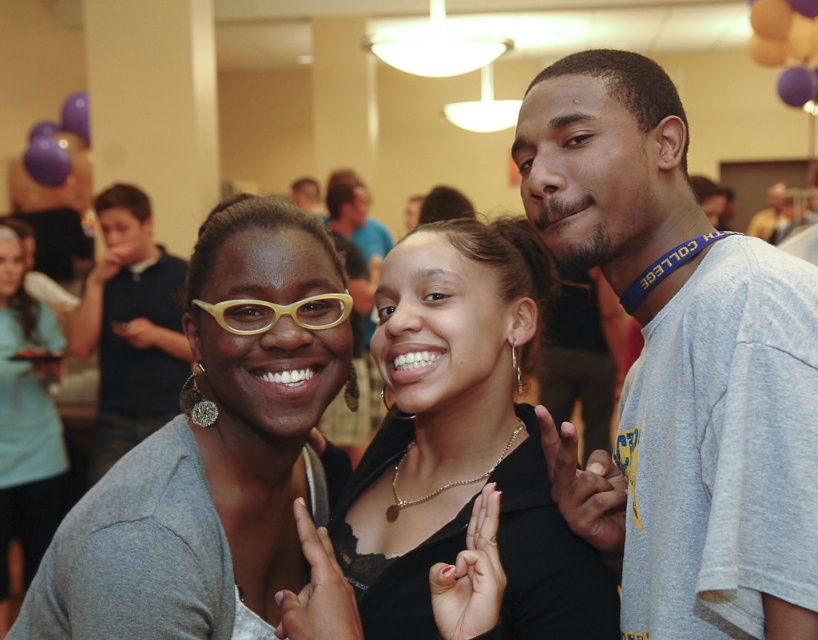
You are standing in the room and see two points marked in the image. Which point is closer to you, point [241,406] or point [106,445]?

Point [241,406] is closer to the viewer than point [106,445].

You are at a social event and see two people wearing the matte black shirt at left and the matte gray sweater at center. Which one is positioned more to the left?

The matte gray sweater at center is positioned more to the left than the matte black shirt at left.

You are organizing a photo shoot and need to place two props next to the people in the image. The first prop requires a space wider than the matte black shirt at left, and the second prop needs a space wider than the matte gray sweater at center. Based on the scene, can both props fit next to their respective clothing items?

The matte black shirt at left might be wider than the matte gray sweater at center. Therefore, the prop needing space wider than the matte black shirt at left may not fit if the shirt itself is already wider than the sweater. However, the prop for the matte gray sweater at center could potentially fit if its required space is less than the sweater. Without exact measurements, it is uncertain if both props will fit.